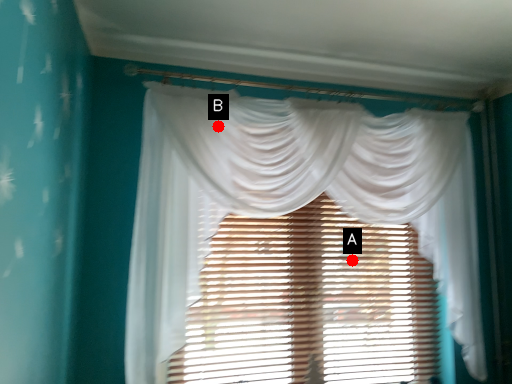
Question: Two points are circled on the image, labeled by A and B beside each circle. Which point is closer to the camera taking this photo?

Choices:
 (A) A is closer
 (B) B is closer

Answer: (B)